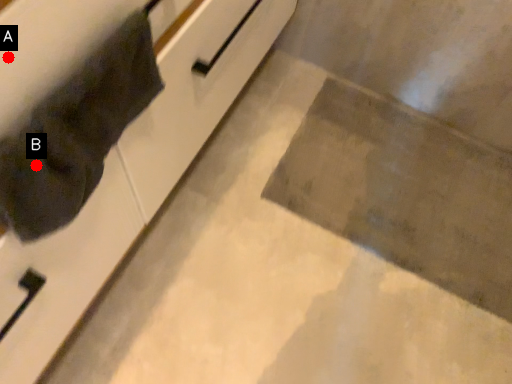
Question: Two points are circled on the image, labeled by A and B beside each circle. Among these points, which one is farthest from the camera?

Choices:
 (A) A is further
 (B) B is further

Answer: (B)